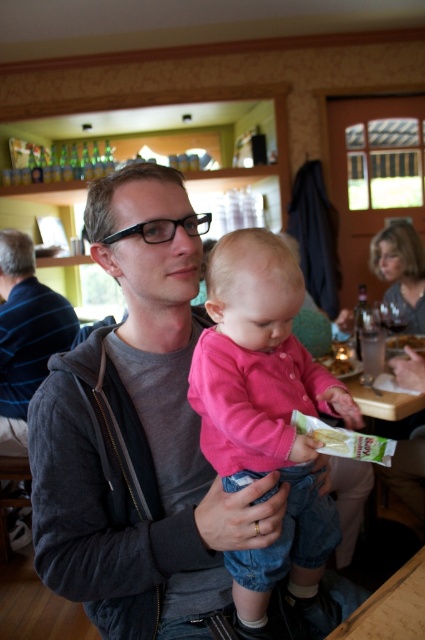
Is gray matte jacket at center shorter than green matte snack packet at center?

No.

Locate an element on the screen. Image resolution: width=425 pixels, height=640 pixels. gray matte jacket at center is located at coordinates (27, 324).

At what (x,y) coordinates should I click in order to perform the action: click on gray matte jacket at center. Please return your answer as a coordinate pair (x, y). Image resolution: width=425 pixels, height=640 pixels. Looking at the image, I should click on (27, 324).

Can you confirm if gray matte jacket at center is positioned above green plastic bag at center?

Yes.

Is gray matte jacket at center thinner than green plastic bag at center?

In fact, gray matte jacket at center might be wider than green plastic bag at center.

Does point (47, 320) lie in front of point (326, 360)?

No, (47, 320) is behind (326, 360).

Where is `gray matte jacket at center`? The width and height of the screenshot is (425, 640). gray matte jacket at center is located at coordinates (27, 324).

Describe the element at coordinates (265, 416) in the screenshot. The width and height of the screenshot is (425, 640). I see `pink matte sweater at center` at that location.

Can you confirm if pink matte sweater at center is bigger than green plastic bag at center?

Correct, pink matte sweater at center is larger in size than green plastic bag at center.

Is point (227, 476) behind point (345, 364)?

No, (227, 476) is in front of (345, 364).

This screenshot has height=640, width=425. In order to click on pink matte sweater at center in this screenshot , I will do `click(265, 416)`.